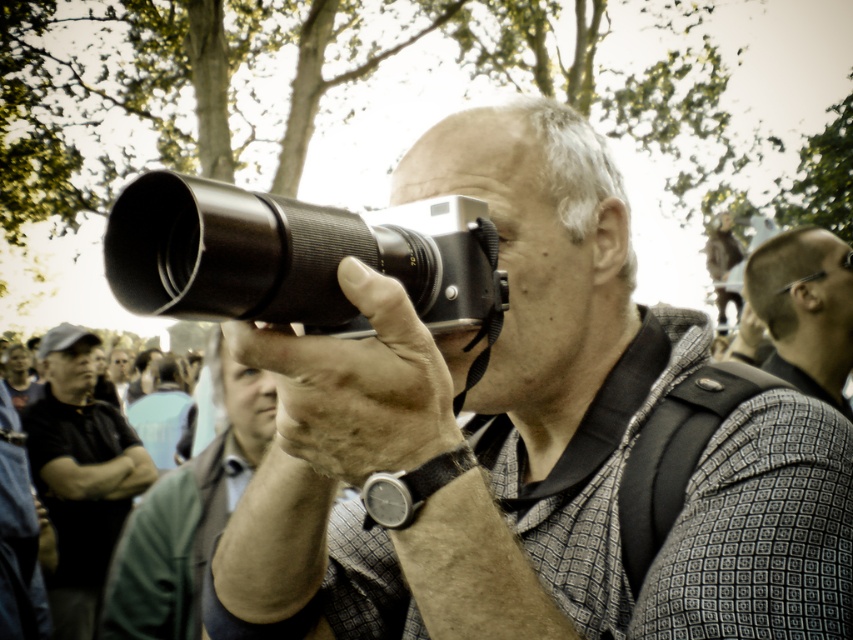
You are a photographer who wants to ensure your equipment is visible to your assistant. Given the silver metallic camera at center and the green leather jacket at center, which object is shorter and would require the assistant to look lower to see it?

The silver metallic camera at center has a lesser height compared to the green leather jacket at center, so the assistant should look lower to see the silver metallic camera at center.

You are a photographer trying to adjust your equipment. You have a matte black camera at center and a green leather jacket at center. Which item is located to the right when viewed from your perspective?

The matte black camera at center is positioned on the right side of the green leather jacket at center, so it is located to the right.

You are a photographer trying to adjust your focus to capture a person in the crowd. You notice two distinct features in your viewfinder. Which of the two, the dark gray cap at lower left or the shiny black hair at upper right, is closer to you?

The dark gray cap at lower left is closer to you because the shiny black hair at upper right is behind it.